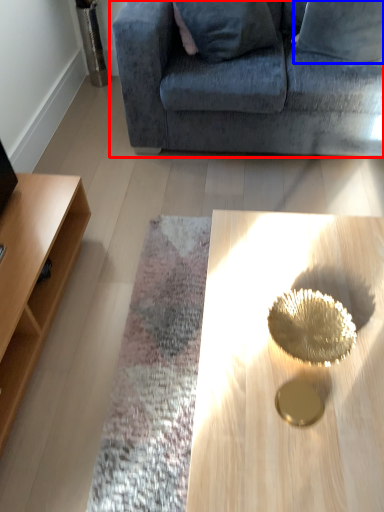
Question: Which object is further to the camera taking this photo, studio couch (highlighted by a red box) or pillow (highlighted by a blue box)?

Choices:
 (A) studio couch
 (B) pillow

Answer: (B)